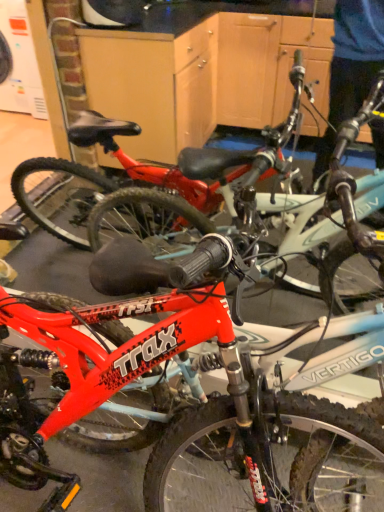
Question: From the image's perspective, relative to shiny red bicycle at center, the first bicycle viewed from the top, is shiny red bicycle at center, positioned as the 1th bicycle in bottom-to-top order, above or below?

Choices:
 (A) above
 (B) below

Answer: (B)

Question: Based on their positions, is shiny red bicycle at center, marked as the 2th bicycle in a top-to-bottom arrangement, located to the left or right of shiny red bicycle at center, the first bicycle viewed from the top?

Choices:
 (A) left
 (B) right

Answer: (B)

Question: Which is correct: shiny red bicycle at center, marked as the 2th bicycle in a top-to-bottom arrangement, is inside shiny red bicycle at center, the first bicycle viewed from the top, or outside of it?

Choices:
 (A) outside
 (B) inside

Answer: (A)

Question: From a real-world perspective, relative to shiny red bicycle at center, marked as the 2th bicycle in a top-to-bottom arrangement, is shiny red bicycle at center, the first bicycle viewed from the top, vertically above or below?

Choices:
 (A) below
 (B) above

Answer: (B)

Question: In terms of size, does shiny red bicycle at center, the 2th bicycle in the bottom-to-top sequence, appear bigger or smaller than shiny red bicycle at center, positioned as the 1th bicycle in bottom-to-top order?

Choices:
 (A) small
 (B) big

Answer: (A)

Question: Considering their positions, is shiny red bicycle at center, the 2th bicycle in the bottom-to-top sequence, located in front of or behind shiny red bicycle at center, positioned as the 1th bicycle in bottom-to-top order?

Choices:
 (A) front
 (B) behind

Answer: (B)

Question: Considering the positions of shiny red bicycle at center, the first bicycle viewed from the top, and shiny red bicycle at center, marked as the 2th bicycle in a top-to-bottom arrangement, in the image, is shiny red bicycle at center, the first bicycle viewed from the top, wider or thinner than shiny red bicycle at center, marked as the 2th bicycle in a top-to-bottom arrangement,?

Choices:
 (A) wide
 (B) thin

Answer: (B)